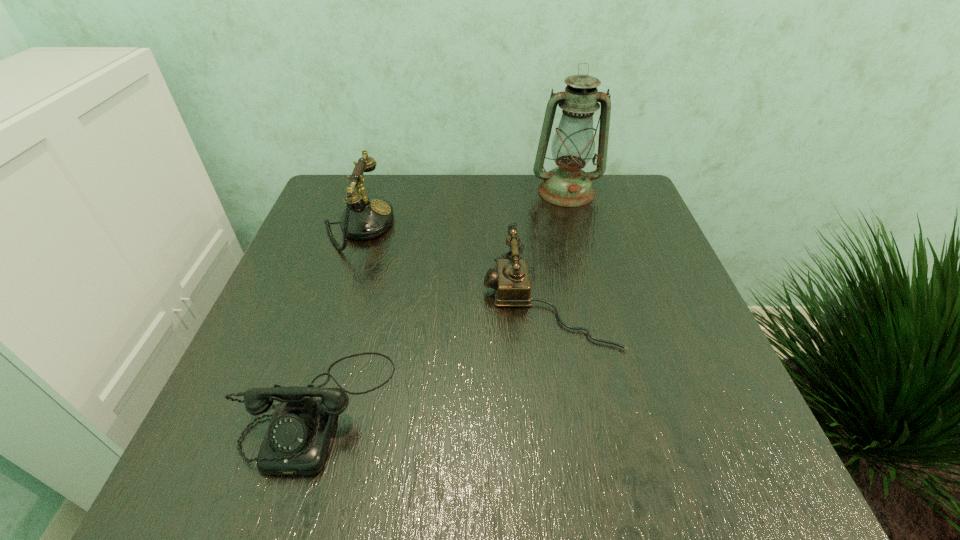
Where is `oil lamp`? oil lamp is located at coordinates (573, 145).

The image size is (960, 540). Find the location of `the farthest telephone`. the farthest telephone is located at coordinates (365, 217).

Find the location of a particular element. the third shortest object is located at coordinates (365, 217).

Where is `the third tallest object`? This screenshot has width=960, height=540. the third tallest object is located at coordinates (511, 281).

I want to click on the rightmost telephone, so click(x=511, y=281).

This screenshot has width=960, height=540. I want to click on the nearest object, so click(x=297, y=439).

This screenshot has width=960, height=540. Find the location of `the shortest telephone`. the shortest telephone is located at coordinates (297, 439).

What are the coordinates of `vacant space located on the right of the oil lamp` in the screenshot? It's located at (627, 192).

The image size is (960, 540). In order to click on vacant space located 0.230m on the dial of the farthest telephone in this screenshot , I will do `click(485, 226)`.

At what (x,y) coordinates should I click in order to perform the action: click on free space located on the dial of the second shortest object. Please return your answer as a coordinate pair (x, y). Looking at the image, I should click on (375, 300).